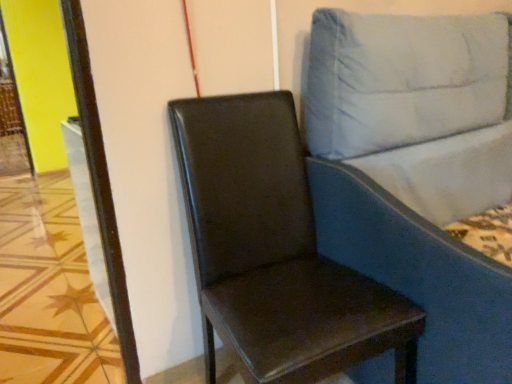
At what (x,y) coordinates should I click in order to perform the action: click on glossy brown leather chair at center. Please return your answer as a coordinate pair (x, y). Looking at the image, I should click on (275, 251).

This screenshot has width=512, height=384. What do you see at coordinates (275, 251) in the screenshot? I see `glossy brown leather chair at center` at bounding box center [275, 251].

Describe the element at coordinates (416, 171) in the screenshot. The image size is (512, 384). I see `blue fabric studio couch at right` at that location.

This screenshot has width=512, height=384. Identify the location of blue fabric studio couch at right. coord(416,171).

Find the location of a particular element. glossy brown leather chair at center is located at coordinates (275, 251).

In the scene shown: Which object is positioned more to the left, blue fabric studio couch at right or glossy brown leather chair at center?

From the viewer's perspective, glossy brown leather chair at center appears more on the left side.

Relative to glossy brown leather chair at center, is blue fabric studio couch at right in front or behind?

blue fabric studio couch at right is in front of glossy brown leather chair at center.

Is point (340, 253) positioned in front of point (368, 350)?

No, it is not.

From the image's perspective, is blue fabric studio couch at right located above or below glossy brown leather chair at center?

Based on their image positions, blue fabric studio couch at right is located above glossy brown leather chair at center.

From a real-world perspective, who is located higher, blue fabric studio couch at right or glossy brown leather chair at center?

From a 3D spatial view, blue fabric studio couch at right is above.

Which object is wider, blue fabric studio couch at right or glossy brown leather chair at center?

blue fabric studio couch at right.

Which of these two, blue fabric studio couch at right or glossy brown leather chair at center, stands shorter?

Standing shorter between the two is glossy brown leather chair at center.

Is blue fabric studio couch at right bigger than glossy brown leather chair at center?

Yes.

Does blue fabric studio couch at right contain glossy brown leather chair at center?

No, glossy brown leather chair at center is located outside of blue fabric studio couch at right.

Is blue fabric studio couch at right with glossy brown leather chair at center?

No, blue fabric studio couch at right is not with glossy brown leather chair at center.

Based on the photo, could you tell me if blue fabric studio couch at right is turned towards glossy brown leather chair at center?

No, blue fabric studio couch at right does not turn towards glossy brown leather chair at center.

Can you tell me how much blue fabric studio couch at right and glossy brown leather chair at center differ in facing direction?

They differ by 4.1 degrees in their facing directions.

This screenshot has height=384, width=512. In order to click on studio couch to the right of glossy brown leather chair at center in this screenshot , I will do `click(416, 171)`.

Considering the positions of objects glossy brown leather chair at center and blue fabric studio couch at right in the image provided, who is more to the right, glossy brown leather chair at center or blue fabric studio couch at right?

blue fabric studio couch at right.

Looking at this image, which object is further away from the camera, glossy brown leather chair at center or blue fabric studio couch at right?

glossy brown leather chair at center is further from the camera.

Is point (302, 239) positioned after point (373, 246)?

Yes, point (302, 239) is behind point (373, 246).

Consider the image. From the image's perspective, which is above, glossy brown leather chair at center or blue fabric studio couch at right?

From the image's view, blue fabric studio couch at right is above.

From a real-world perspective, is glossy brown leather chair at center above or below blue fabric studio couch at right?

In terms of real-world spatial position, glossy brown leather chair at center is below blue fabric studio couch at right.

Is glossy brown leather chair at center wider or thinner than blue fabric studio couch at right?

Clearly, glossy brown leather chair at center has less width compared to blue fabric studio couch at right.

From their relative heights in the image, would you say glossy brown leather chair at center is taller or shorter than blue fabric studio couch at right?

Considering their sizes, glossy brown leather chair at center has less height than blue fabric studio couch at right.

In the scene shown: Can you confirm if glossy brown leather chair at center is bigger than blue fabric studio couch at right?

Incorrect, glossy brown leather chair at center is not larger than blue fabric studio couch at right.

Is glossy brown leather chair at center not inside blue fabric studio couch at right?

Yes, glossy brown leather chair at center is not within blue fabric studio couch at right.

Would you say glossy brown leather chair at center is a long distance from blue fabric studio couch at right?

No, there isn't a large distance between glossy brown leather chair at center and blue fabric studio couch at right.

Is glossy brown leather chair at center facing away from blue fabric studio couch at right?

No, blue fabric studio couch at right is not at the back of glossy brown leather chair at center.

Consider the image. What's the angular difference between glossy brown leather chair at center and blue fabric studio couch at right's facing directions?

There is a 4.1-degree angle between the facing directions of glossy brown leather chair at center and blue fabric studio couch at right.

How much distance is there between glossy brown leather chair at center and blue fabric studio couch at right?

The distance of glossy brown leather chair at center from blue fabric studio couch at right is 12.09 inches.

At what (x,y) coordinates should I click in order to perform the action: click on studio couch that is above the glossy brown leather chair at center (from the image's perspective). Please return your answer as a coordinate pair (x, y). The height and width of the screenshot is (384, 512). Looking at the image, I should click on (416, 171).

I want to click on chair that appears on the left of blue fabric studio couch at right, so click(275, 251).

The width and height of the screenshot is (512, 384). What are the coordinates of `chair below the blue fabric studio couch at right (from the image's perspective)` in the screenshot? It's located at (275, 251).